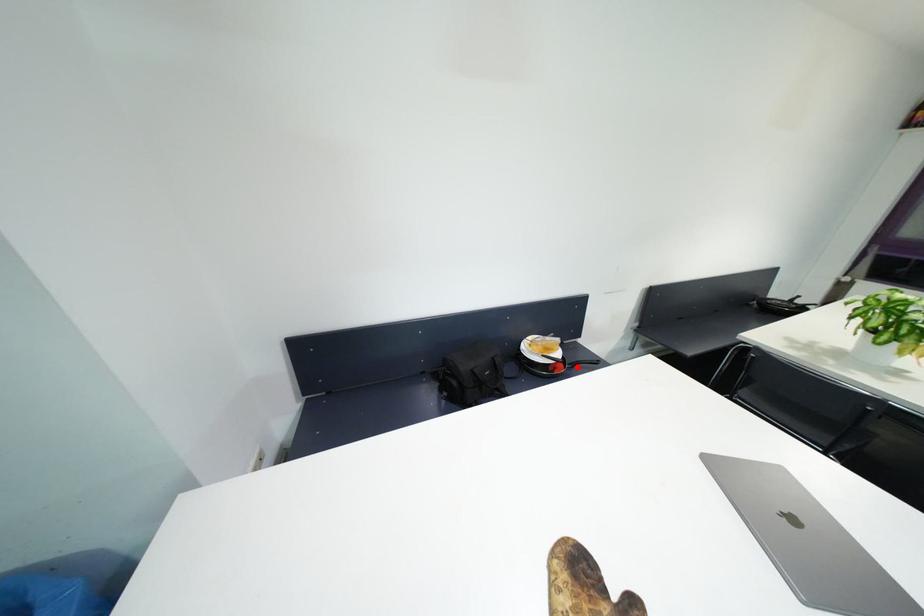
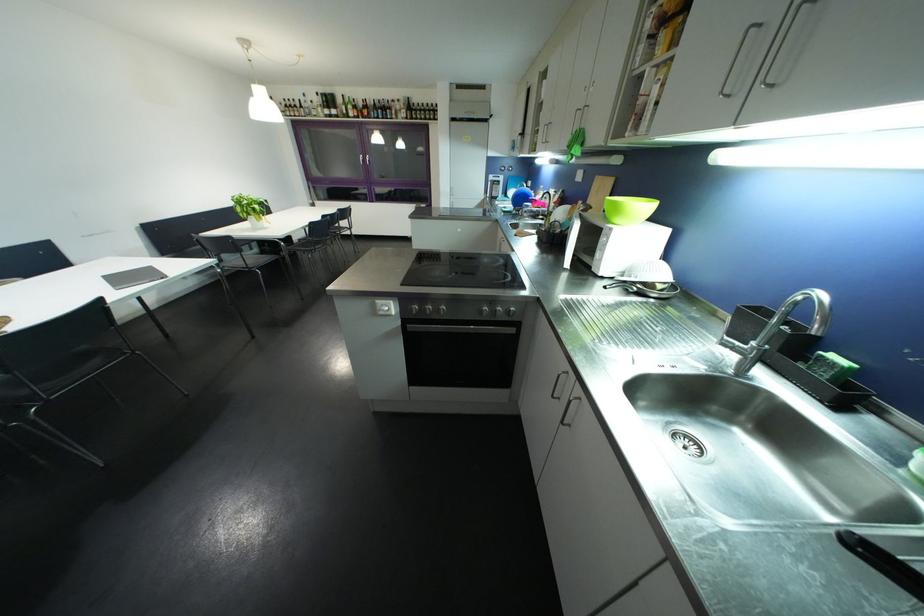
Question: I am providing you with two images of the same scene from different viewpoints. A red point is marked on the first image. At the location where the point appears in image 1, is it still visible in image 2?

Choices:
 (A) Yes
 (B) No

Answer: (B)